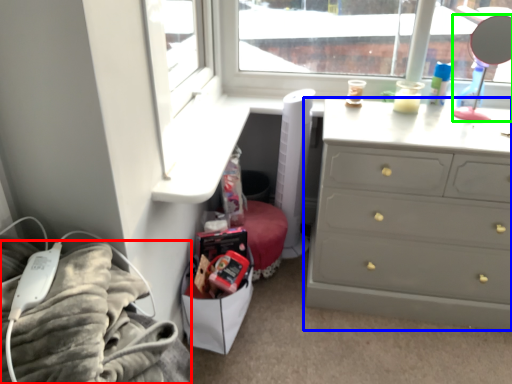
Question: Which object is the closest to the bedding (highlighted by a red box)? Choose among these: chest of drawers (highlighted by a blue box) or mirror (highlighted by a green box).

Choices:
 (A) chest of drawers
 (B) mirror

Answer: (A)